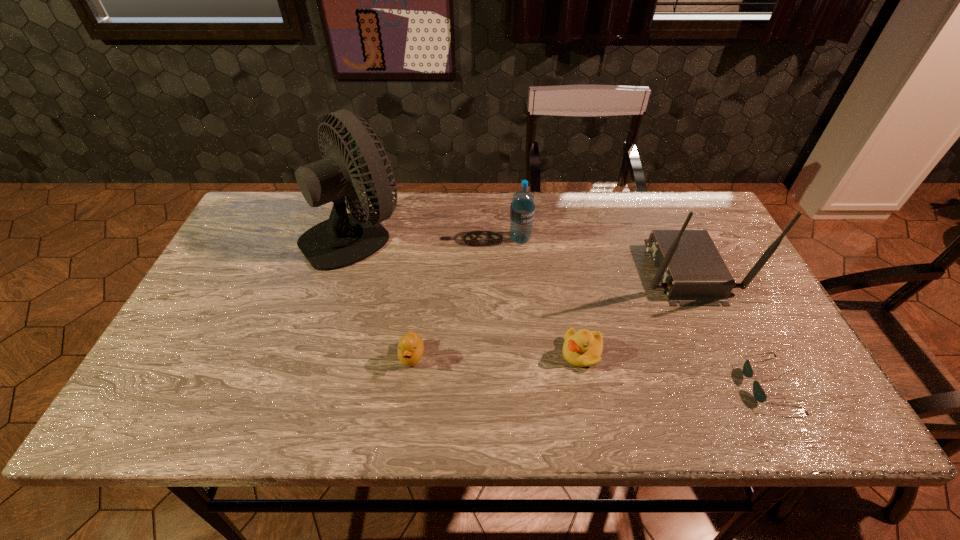
This screenshot has width=960, height=540. Find the location of `free space located on the back of the router to connect cables`. free space located on the back of the router to connect cables is located at coordinates (588, 271).

I want to click on free space located 0.150m on the back of the router to connect cables, so click(585, 271).

The image size is (960, 540). I want to click on vacant space located 0.190m on the left of the water bottle, so click(x=444, y=239).

This screenshot has height=540, width=960. I want to click on free space located 0.230m on the beak of the third object from right to left, so click(463, 353).

Locate an element on the screen. vacant point located 0.390m on the beak of the third object from right to left is located at coordinates (394, 353).

At what (x,y) coordinates should I click in order to perform the action: click on vacant space situated 0.110m on the beak of the third object from right to left. Please return your answer as a coordinate pair (x, y). Looking at the image, I should click on (515, 353).

I want to click on free region located facing forward on the second object from left to right, so click(405, 409).

What are the coordinates of `vacant area situated 0.280m on the lenses of the sunglasses` in the screenshot? It's located at pyautogui.click(x=620, y=386).

Where is `free region located 0.220m on the lenses of the sunglasses`? Image resolution: width=960 pixels, height=540 pixels. free region located 0.220m on the lenses of the sunglasses is located at coordinates (647, 386).

Image resolution: width=960 pixels, height=540 pixels. I want to click on free space located on the lenses of the sunglasses, so click(615, 386).